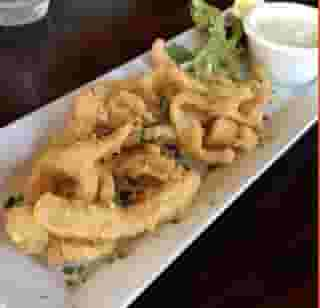
Find the location of a particular element. The image size is (320, 308). tabletop is located at coordinates (280, 258), (99, 44).